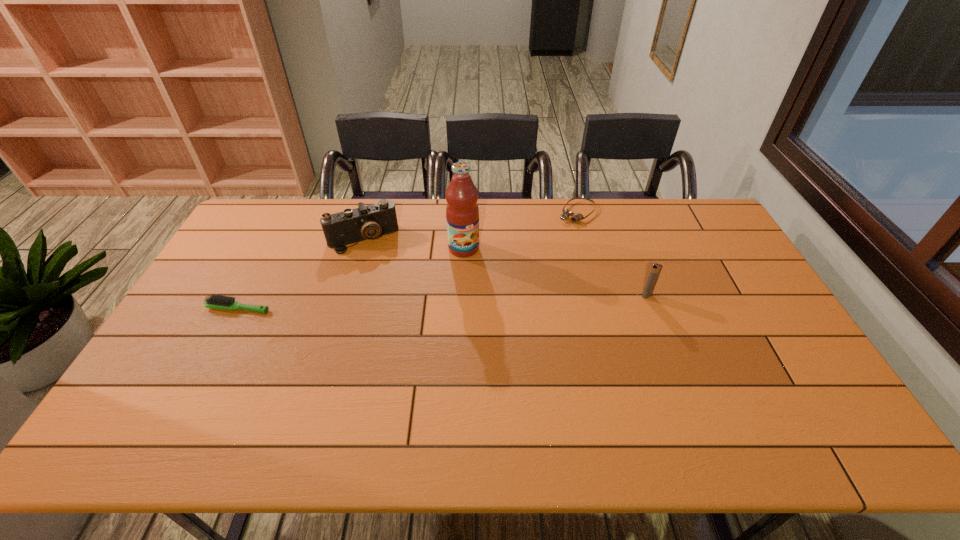
Locate an element on the screen. The height and width of the screenshot is (540, 960). vacant region located on the front label of the tallest object is located at coordinates (496, 308).

This screenshot has width=960, height=540. What are the coordinates of `vacant space situated on the front label of the tallest object` in the screenshot? It's located at (502, 320).

Locate an element on the screen. The width and height of the screenshot is (960, 540). vacant space located on the front label of the tallest object is located at coordinates (x=491, y=299).

This screenshot has height=540, width=960. Identify the location of vacant point located on the front-facing side of the camera. (394, 303).

At what (x,y) coordinates should I click in order to perform the action: click on blank space located on the front-facing side of the camera. Please return your answer as a coordinate pair (x, y). Image resolution: width=960 pixels, height=540 pixels. Looking at the image, I should click on (389, 290).

The height and width of the screenshot is (540, 960). What are the coordinates of `free location located on the front-facing side of the camera` in the screenshot? It's located at (404, 327).

Find the location of a particular element. vacant space situated on the front lenses and sides of the second object from right to left is located at coordinates (530, 262).

What are the coordinates of `vacant space located on the front lenses and sides of the second object from right to left` in the screenshot? It's located at (523, 269).

The width and height of the screenshot is (960, 540). In order to click on vacant position located 0.180m on the front lenses and sides of the second object from right to left in this screenshot , I will do `click(543, 248)`.

The image size is (960, 540). What are the coordinates of `camera positioned at the far edge` in the screenshot? It's located at (369, 222).